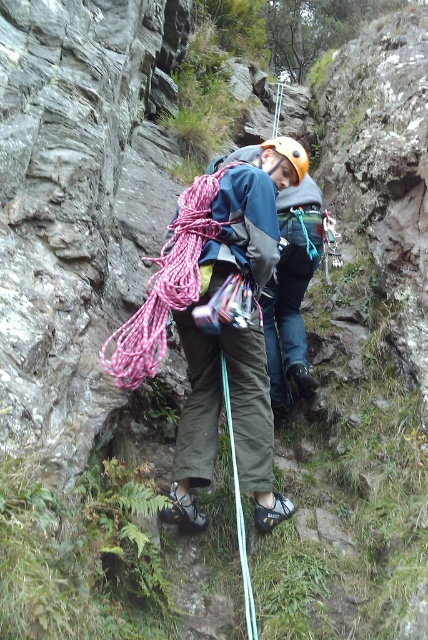
You are a safety inspector reviewing a rock climbing setup. The climber is wearing a matte blue jacket at center. According to safety protocols, the maximum safe distance between the climber and the inspector for a clear visual inspection is 5 meters. Is the current distance within the safe limit?

The matte blue jacket at center is 5.93 meters away from the camera, which exceeds the 5 meter safe distance. The inspector should move closer to ensure proper visual inspection.

You are a rock climber looking at the scene. Where is the matte blue jacket at center located in terms of its 2D coordinates?

The matte blue jacket at center is located at the 2D coordinates of point (217, 419).